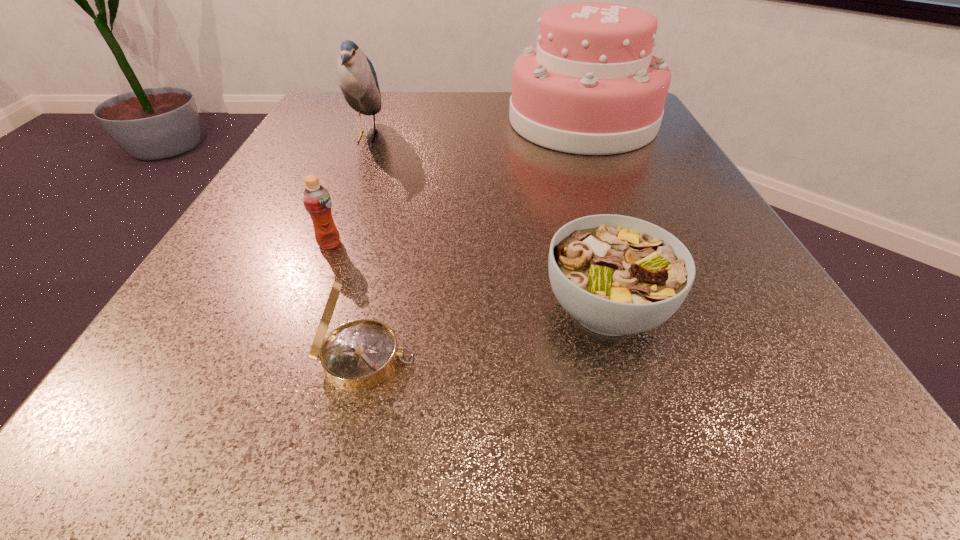
The image size is (960, 540). What are the coordinates of `vacant area between the bird and the orange juice` in the screenshot? It's located at (348, 190).

I want to click on unoccupied position between the birthday cake and the third farthest object, so click(x=456, y=183).

I want to click on free space between the birthday cake and the orange juice, so click(456, 183).

Find the location of `blank region between the birthday cake and the orange juice`. blank region between the birthday cake and the orange juice is located at coordinates (456, 183).

Where is `unoccupied position between the third object from right to left and the bird`? unoccupied position between the third object from right to left and the bird is located at coordinates (367, 248).

This screenshot has width=960, height=540. I want to click on free spot between the bird and the third nearest object, so click(x=348, y=190).

Locate an element on the screen. object that ranks as the second closest to the compass is located at coordinates (616, 275).

Where is `object that is the third closest to the bird`? This screenshot has height=540, width=960. object that is the third closest to the bird is located at coordinates (616, 275).

Find the location of a particular element. This screenshot has width=960, height=540. free space in the image that satisfies the following two spatial constraints: 1. at the tip of the orange juice's beak; 2. on the left side of the bird is located at coordinates (323, 244).

Find the location of a particular element. Image resolution: width=960 pixels, height=540 pixels. free space that satisfies the following two spatial constraints: 1. on the front side of the birthday cake; 2. at the tip of the bird's beak is located at coordinates (588, 137).